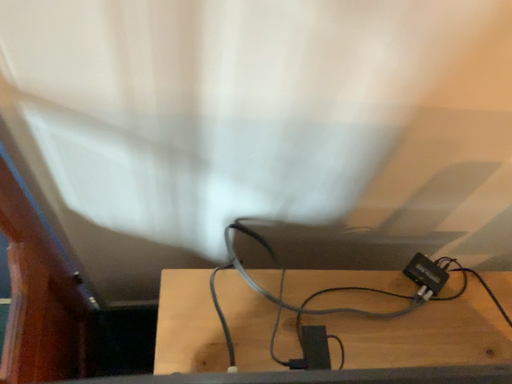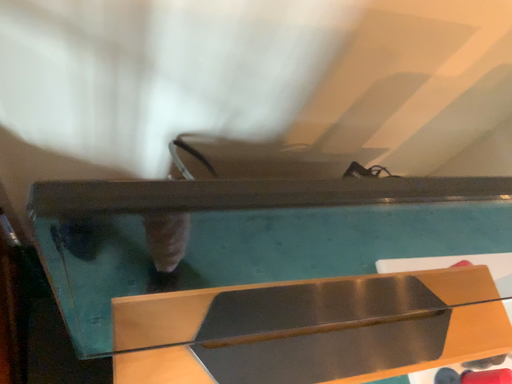
Question: How did the camera likely rotate when shooting the video?

Choices:
 (A) rotated right
 (B) rotated left

Answer: (A)